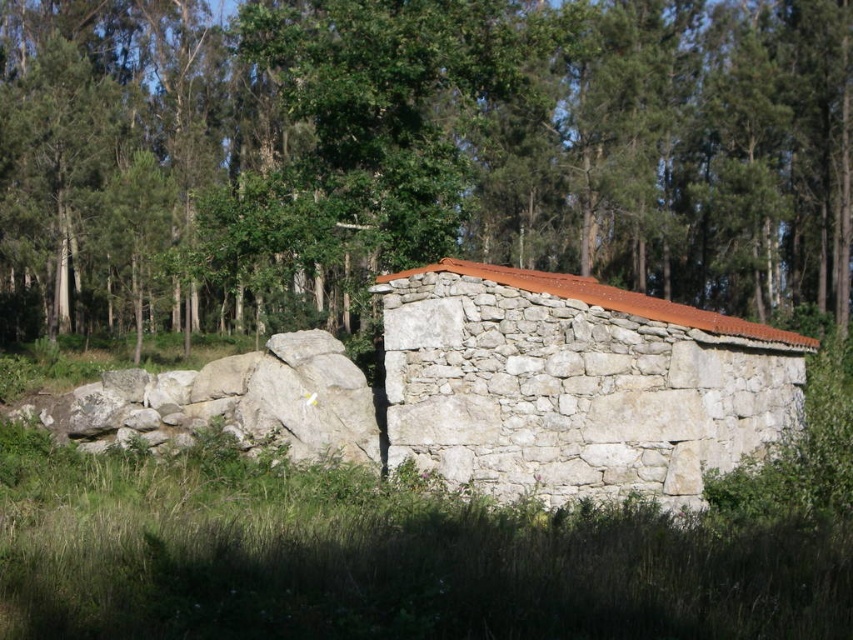
You are standing in front of the rustic stone structure and looking towards the green leafy tree at center. Which object is directly above the green grass at lower center?

The green leafy tree at center is positioned over the green grass at lower center, so the green leafy tree at center is directly above the green grass at lower center.

You are standing in front of the rustic stone structure and want to take a photo that includes both point (231,566) and point (387,284) in the frame. Which point should you focus on to ensure both are in focus?

You should focus on point (387,284) because it is farther from the camera than point (231,566). By focusing on the farther point, the depth of field will include the closer point as well.